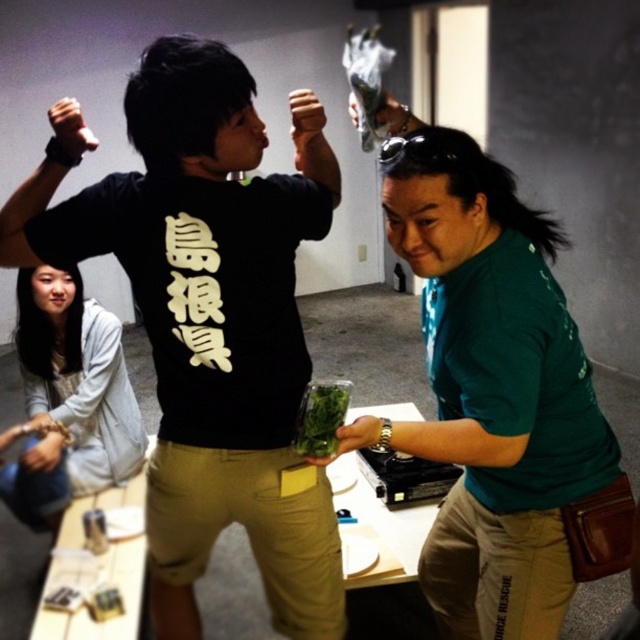
Question: Can you confirm if wooden table at center is positioned above green leafy vegetable at center?

Choices:
 (A) no
 (B) yes

Answer: (A)

Question: Considering the relative positions of light gray hoodie at lower left and green matte leafy greens at center in the image provided, where is light gray hoodie at lower left located with respect to green matte leafy greens at center?

Choices:
 (A) left
 (B) right

Answer: (A)

Question: Does black matte t-shirt at center have a larger size compared to green leafy vegetable at center?

Choices:
 (A) no
 (B) yes

Answer: (B)

Question: Which of the following is the closest to the observer?

Choices:
 (A) green matte leafy greens at center
 (B) matte black hand at upper center

Answer: (A)

Question: Which point is closer to the camera taking this photo?

Choices:
 (A) 76,120
 (B) 397,556

Answer: (A)

Question: Which point appears closest to the camera in this image?

Choices:
 (A) (326, 381)
 (B) (154, 188)

Answer: (B)